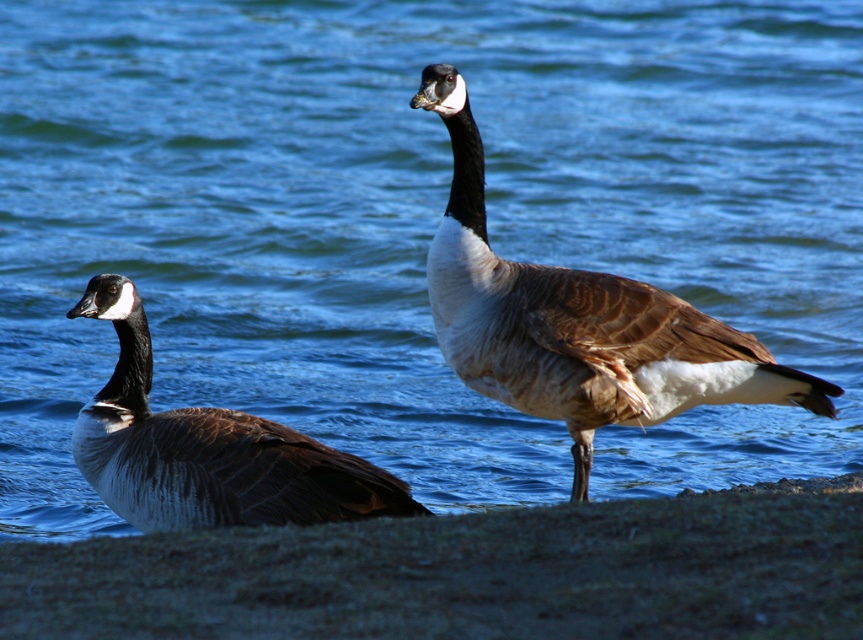
You are standing at the point labeled as point (x=471, y=573) and want to walk towards the Canada geese. Which direction should you go to reach them?

The sandy shore at lower left is located at point (x=471, y=573). Since the Canada geese are near the body of water, you should walk towards the direction away from the sandy shore to reach them.

You are a birdwatcher observing the scene. You notice the brown feathered goose at center and the brown feathered duck at left. Which bird is closer to the water surface?

The brown feathered goose at center is positioned over the brown feathered duck at left, meaning it is closer to the water surface.